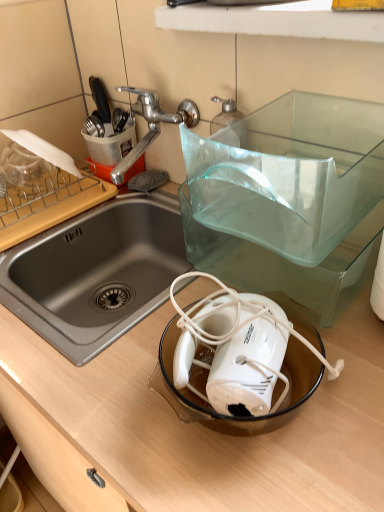
I want to click on vacant space situated on the left part of white plastic mixer at center, so click(x=113, y=387).